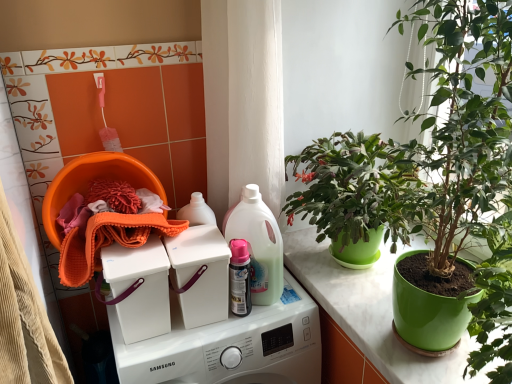
Locate an element on the screen. This screenshot has width=512, height=384. vacant space in front of pink glossy spray can at center is located at coordinates (228, 330).